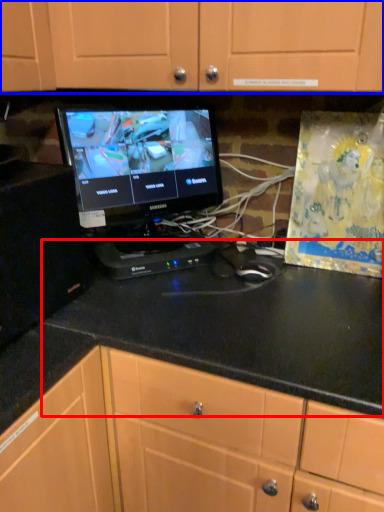
Question: Which of the following is the closest to the observer, counter top (highlighted by a red box) or cabinetry (highlighted by a blue box)?

Choices:
 (A) counter top
 (B) cabinetry

Answer: (A)